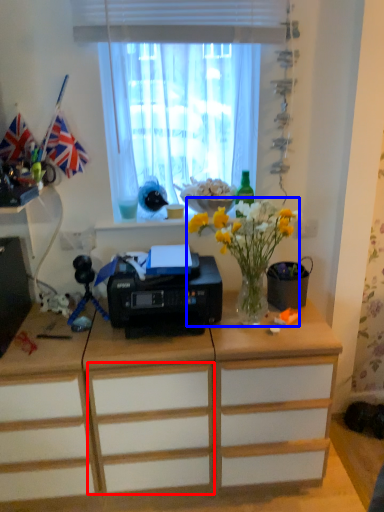
Question: Which object appears closest to the camera in this image, drawer (highlighted by a red box) or floral arrangement (highlighted by a blue box)?

Choices:
 (A) drawer
 (B) floral arrangement

Answer: (B)